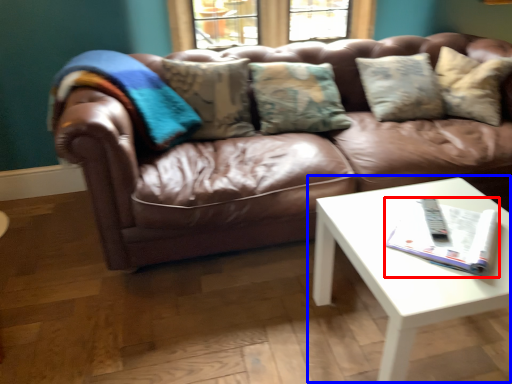
Question: Which point is further to the camera, magazine (highlighted by a red box) or coffee table (highlighted by a blue box)?

Choices:
 (A) magazine
 (B) coffee table

Answer: (A)